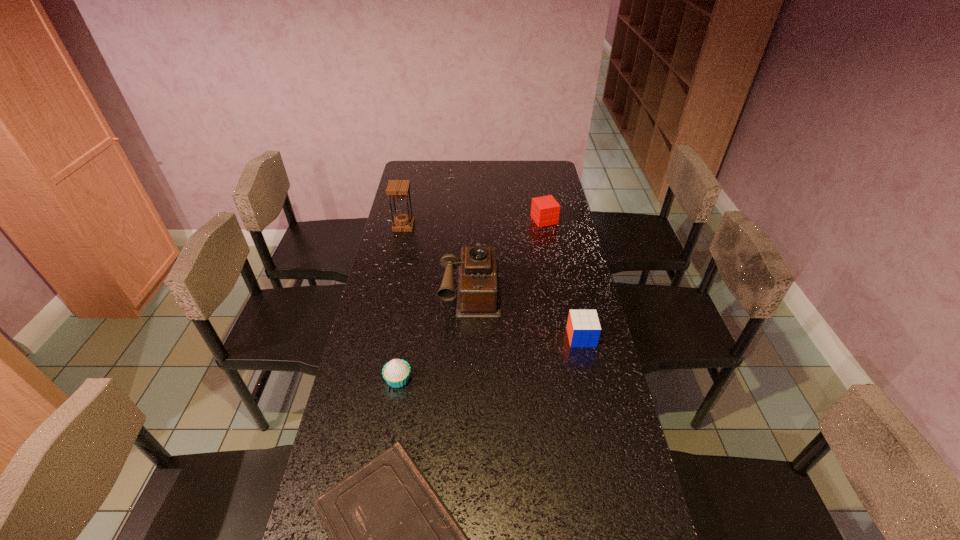
The image size is (960, 540). Find the location of `hourglass`. hourglass is located at coordinates (403, 222).

Find the location of a particular element. The image size is (960, 540). the third farthest object is located at coordinates (478, 296).

Find the location of `the fifth shortest object`. the fifth shortest object is located at coordinates (478, 296).

I want to click on the farther cube, so click(x=545, y=210).

The width and height of the screenshot is (960, 540). What are the coordinates of `cupcake` in the screenshot? It's located at (x=396, y=372).

The width and height of the screenshot is (960, 540). I want to click on the nearer cube, so click(x=583, y=327).

The image size is (960, 540). In order to click on vacant area situated 0.270m on the right of the hourglass in this screenshot , I will do `click(478, 226)`.

At what (x,y) coordinates should I click in order to perform the action: click on free space located on the horn of the fifth shortest object. Please return your answer as a coordinate pair (x, y). This screenshot has width=960, height=540. Looking at the image, I should click on (468, 430).

Where is `free location located 0.070m on the left of the farther cube`? Image resolution: width=960 pixels, height=540 pixels. free location located 0.070m on the left of the farther cube is located at coordinates (515, 220).

Where is `free point located 0.370m on the right of the cupcake`? This screenshot has width=960, height=540. free point located 0.370m on the right of the cupcake is located at coordinates (540, 379).